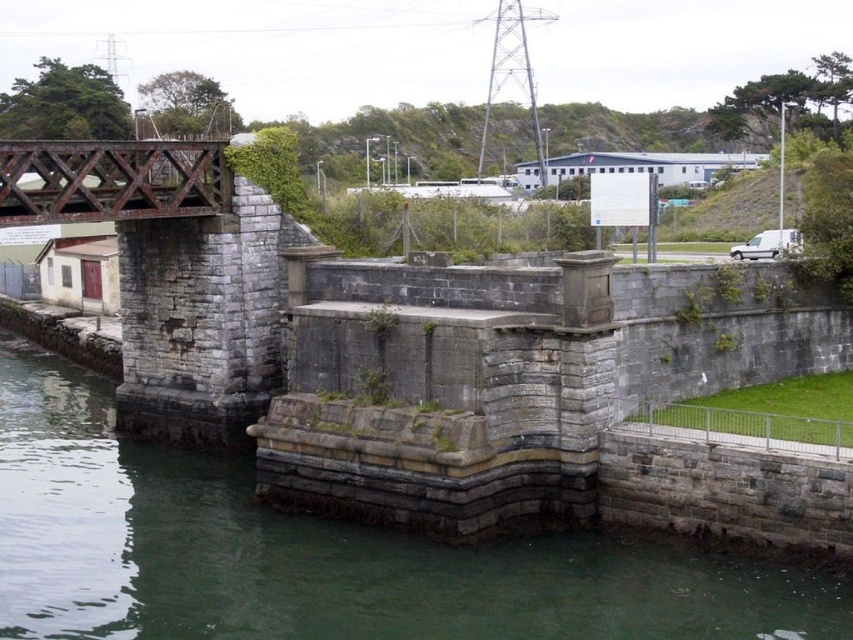
You are a painter who wants to paint both the gray stone wall at lower left and the rusty metal bridge at upper left. Which object should you focus on first if you want to paint the wider one?

The gray stone wall at lower left might be wider than the rusty metal bridge at upper left, so you should focus on painting the gray stone wall at lower left first.

You are standing on the gray stone wall at lower left and want to climb onto the rusty metal bridge at upper left. Is the height difference between them a concern?

The gray stone wall at lower left is not as tall as the rusty metal bridge at upper left, so the height difference may require careful climbing to reach the bridge safely.

You are standing at the center of the stone bridge and want to locate the gray stone wall at lower left. Based on the coordinate system where the bottom left corner is the origin, can you determine its position?

The gray stone wall at lower left is located at coordinate point (318, 554).